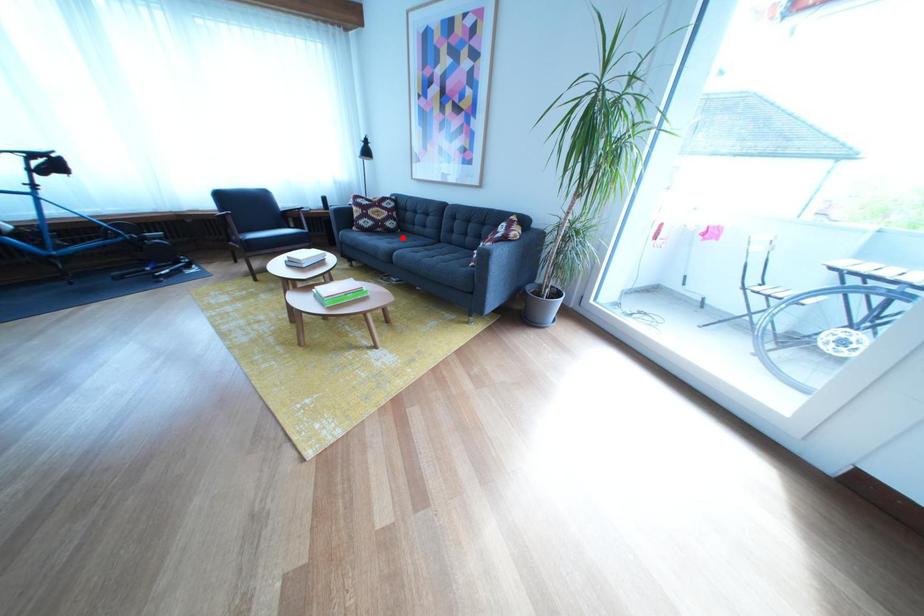
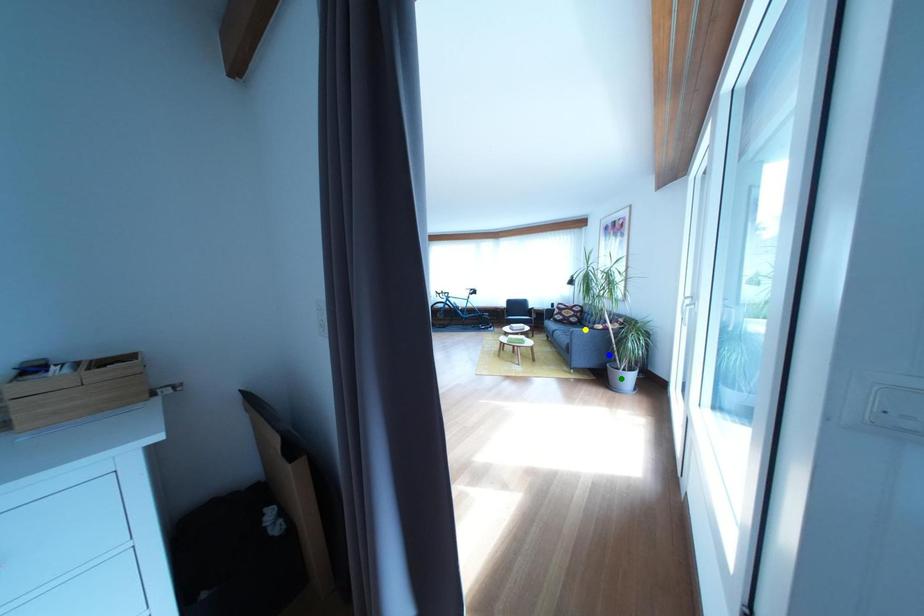
Question: I am providing you with two images of the same scene from different viewpoints. A red point is marked on the first image. You are given multiple points on the second image. Which mark in image 2 goes with the point in image 1?

Choices:
 (A) blue point
 (B) green point
 (C) yellow point

Answer: (C)